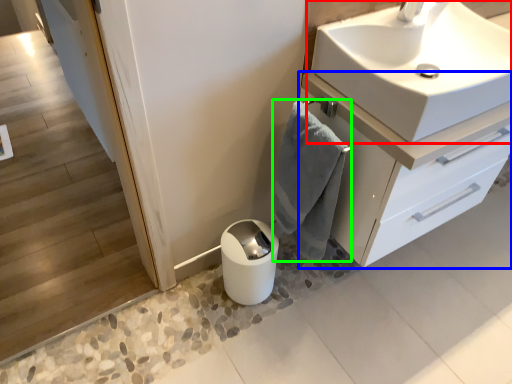
Question: Based on their relative distances, which object is nearer to sink (highlighted by a red box)? Choose from bathroom cabinet (highlighted by a blue box) and bath towel (highlighted by a green box).

Choices:
 (A) bathroom cabinet
 (B) bath towel

Answer: (A)